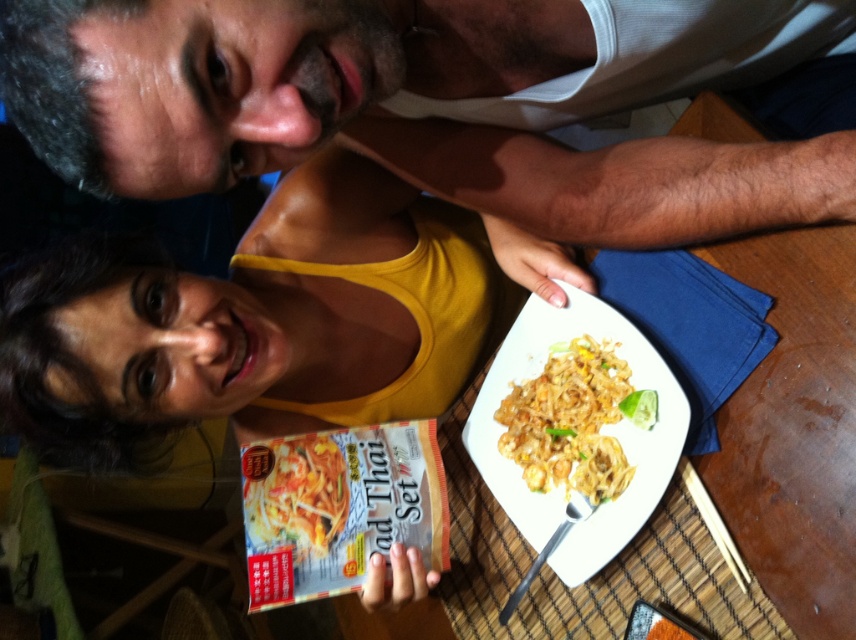
You are a delivery person who needs to place a small package on the table between the white tank top at upper center and the yellow matte pad thai set at center. Can you fit it there without covering either item?

The white tank top at upper center is taller than the yellow matte pad thai set at center. Since the package is small, it can be placed between them without covering either item as long as it is positioned in the space between their bases.

Consider the image. You are a food delivery person who just arrived at the location. You need to place the yellowish matte noodles at center onto the yellow matte pad thai set at center. Is the noodles already positioned correctly for delivery?

The yellowish matte noodles at center is closer to the viewer than the yellow matte pad thai set at center, so the noodles are not positioned correctly for delivery. You need to move the noodles to be on top of the yellow matte pad thai set at center.

Consider the image. You are sitting at the table and want to place the yellow matte pad thai set at center onto the shiny white plate at center. Can you do this without moving either object?

The shiny white plate at center is closer to the viewer than the yellow matte pad thai set at center, so you can place the yellow matte pad thai set at center onto the shiny white plate at center by moving it forward since the plate is in front of the set.